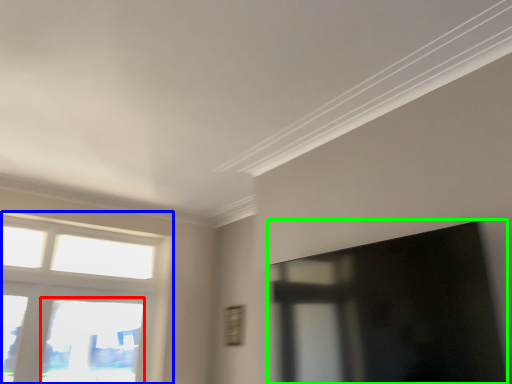
Question: Which object is positioned farthest from window (highlighted by a red box)? Select from window (highlighted by a blue box) and window screen (highlighted by a green box).

Choices:
 (A) window
 (B) window screen

Answer: (B)